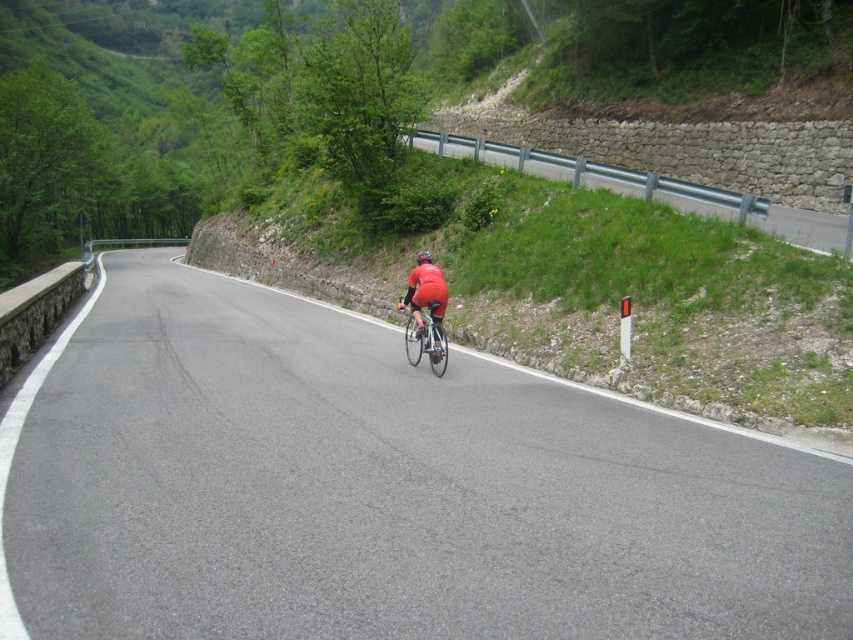
You are a cyclist wearing a matte red helmet at center. You need to stay on the asphalt road at center. Which direction should you steer your bike to stay on the road?

The asphalt road at center is positioned on the left side of the matte red helmet at center. To stay on the road, you should steer your bike to the left towards the asphalt road at center.

You are standing at the edge of the road and want to cross to the other side. The cyclist is approaching from your right. Given that the asphalt road at center is 4.30 meters away from you, how much distance do you have to safely cross before the cyclist reaches you?

The asphalt road at center is 4.30 meters away from the viewer, so you have 4.30 meters to safely cross before the cyclist arrives.

You are a cyclist planning to ride along the asphalt road at center. You have a shiny metallic bicycle at center. Which one is bigger in size?

The asphalt road at center has a larger size compared to the shiny metallic bicycle at center.